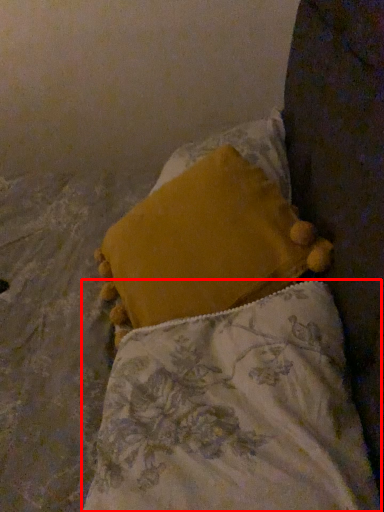
Question: From the image's perspective, what is the correct spatial positioning of pillow (annotated by the red box) in reference to pillow?

Choices:
 (A) below
 (B) above

Answer: (A)